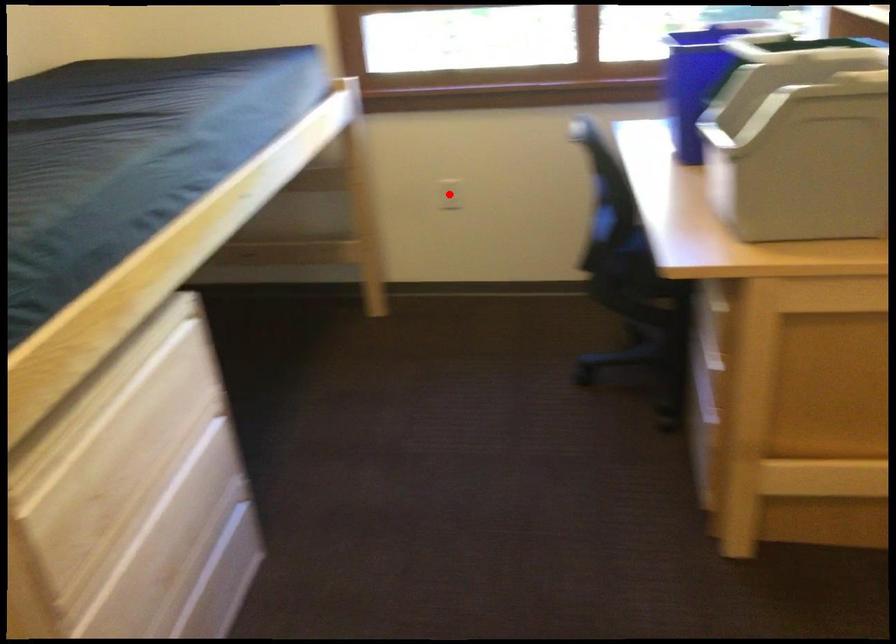
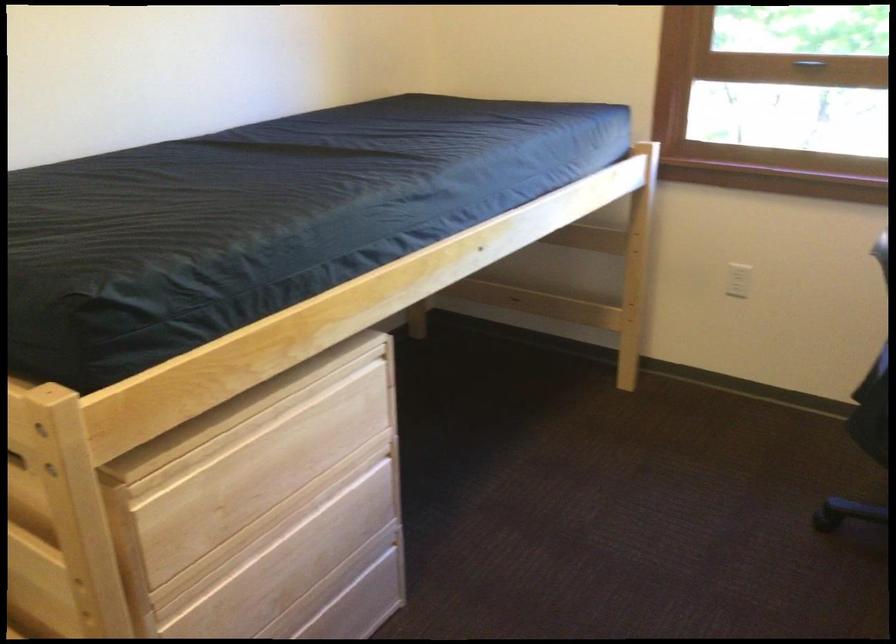
Question: A red point is marked in image1. In image2, is the corresponding 3D point closer to the camera or farther? Reply with the corresponding letter.

Choices:
 (A) The corresponding 3D point is closer.
 (B) The corresponding 3D point is farther.

Answer: (A)